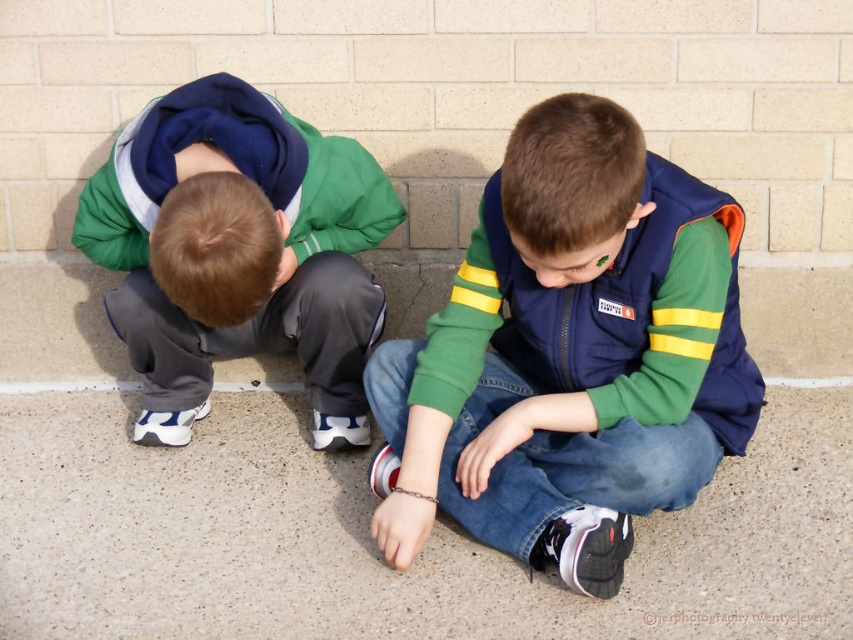
Is smooth concrete pavement at lower center further to the viewer compared to navy blue jacket at center?

That is True.

You are a GUI agent. You are given a task and a screenshot of the screen. Output one action in this format:
    pyautogui.click(x=<x>, y=<y>)
    Task: Click on the smooth concrete pavement at lower center
    
    Given the screenshot: What is the action you would take?
    pyautogui.click(x=373, y=548)

Who is more forward, (x=314, y=595) or (x=602, y=337)?

Point (x=314, y=595) is more forward.

The width and height of the screenshot is (853, 640). Find the location of `smooth concrete pavement at lower center`. smooth concrete pavement at lower center is located at coordinates (373, 548).

Who is lower down, navy blue jacket at center or gray fleece pants at lower left?

navy blue jacket at center

The width and height of the screenshot is (853, 640). What do you see at coordinates (570, 355) in the screenshot? I see `navy blue jacket at center` at bounding box center [570, 355].

Who is more distant from viewer, (x=630, y=289) or (x=178, y=305)?

Positioned behind is point (x=178, y=305).

I want to click on navy blue jacket at center, so click(x=570, y=355).

Which of these two, smooth concrete pavement at lower center or gray fleece pants at lower left, stands shorter?

With less height is smooth concrete pavement at lower center.

Can you confirm if smooth concrete pavement at lower center is positioned to the left of gray fleece pants at lower left?

In fact, smooth concrete pavement at lower center is to the right of gray fleece pants at lower left.

At what (x,y) coordinates should I click in order to perform the action: click on smooth concrete pavement at lower center. Please return your answer as a coordinate pair (x, y). Image resolution: width=853 pixels, height=640 pixels. Looking at the image, I should click on (373, 548).

Where is `smooth concrete pavement at lower center`? Image resolution: width=853 pixels, height=640 pixels. smooth concrete pavement at lower center is located at coordinates (373, 548).